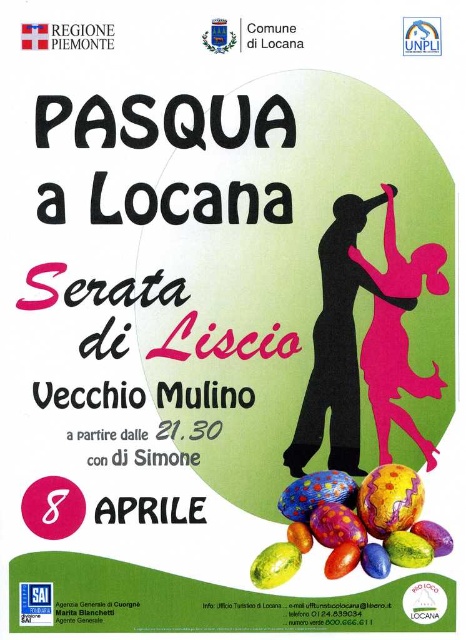
Where is `black matte figure at center`? This screenshot has width=466, height=640. black matte figure at center is located at coordinates (336, 346).

Is point (324, 236) positioned in front of point (393, 528)?

No, it is not.

At what (x,y) coordinates should I click in order to perform the action: click on black matte figure at center. Please return your answer as a coordinate pair (x, y). Looking at the image, I should click on (336, 346).

Locate an element on the screen. Image resolution: width=466 pixels, height=640 pixels. black matte figure at center is located at coordinates (336, 346).

Is polka dot glossy easter egg at lower right bigger than matte yellow easter egg at lower center?

Indeed, polka dot glossy easter egg at lower right has a larger size compared to matte yellow easter egg at lower center.

The image size is (466, 640). What do you see at coordinates (315, 493) in the screenshot? I see `polka dot glossy easter egg at lower right` at bounding box center [315, 493].

Find the location of a particular element. polka dot glossy easter egg at lower right is located at coordinates (315, 493).

Is multicolored glossy easter egg at lower right behind matte yellow easter egg at lower center?

No, multicolored glossy easter egg at lower right is in front of matte yellow easter egg at lower center.

Which of these two, multicolored glossy easter egg at lower right or matte yellow easter egg at lower center, stands taller?

multicolored glossy easter egg at lower right is taller.

Is point (399, 520) farther from viewer compared to point (290, 561)?

No, it is in front of (290, 561).

Where is `multicolored glossy easter egg at lower right`? The width and height of the screenshot is (466, 640). multicolored glossy easter egg at lower right is located at coordinates (390, 499).